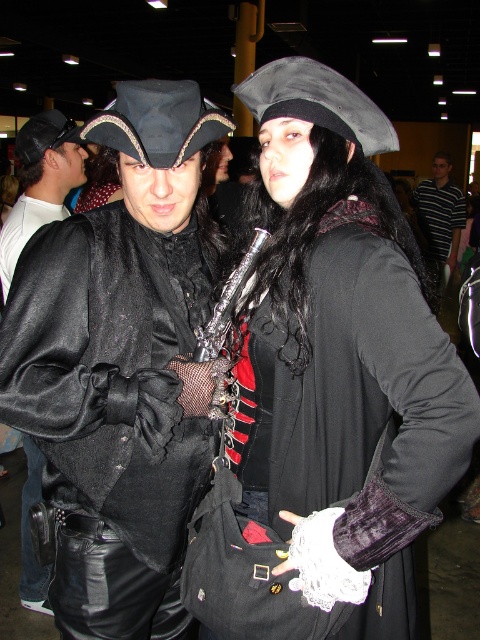
Question: Does matte black jacket at left appear over striped cotton shirt at center?

Choices:
 (A) no
 (B) yes

Answer: (A)

Question: Which point is closer to the camera?

Choices:
 (A) velvet black coat at center
 (B) striped cotton shirt at center

Answer: (A)

Question: Which point appears closest to the camera in this image?

Choices:
 (A) (107, 168)
 (B) (41, 604)
 (C) (170, 380)

Answer: (C)

Question: From the image, what is the correct spatial relationship of velvet black glove at center in relation to velvet black coat at center?

Choices:
 (A) below
 (B) above

Answer: (A)

Question: Among these objects, which one is nearest to the camera?

Choices:
 (A) matte black coat at center
 (B) velvet black glove at center

Answer: (B)

Question: Can you confirm if velvet black glove at center is thinner than striped cotton shirt at center?

Choices:
 (A) no
 (B) yes

Answer: (B)